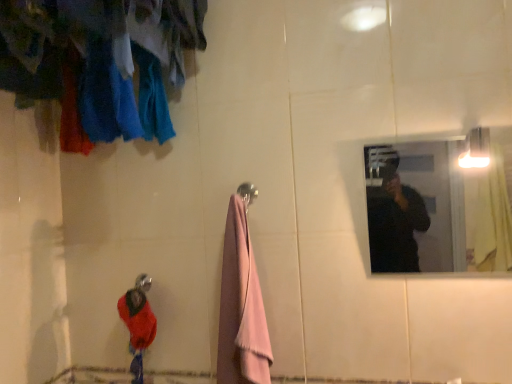
Question: Is velvet red sweater at lower left placed right next to metallic reflective mirror at upper right?

Choices:
 (A) yes
 (B) no

Answer: (B)

Question: Does velvet red sweater at lower left have a smaller size compared to metallic reflective mirror at upper right?

Choices:
 (A) no
 (B) yes

Answer: (B)

Question: Does velvet red sweater at lower left have a lesser width compared to metallic reflective mirror at upper right?

Choices:
 (A) no
 (B) yes

Answer: (A)

Question: Is velvet red sweater at lower left not inside metallic reflective mirror at upper right?

Choices:
 (A) yes
 (B) no

Answer: (A)

Question: Is velvet red sweater at lower left turned away from metallic reflective mirror at upper right?

Choices:
 (A) no
 (B) yes

Answer: (A)

Question: Does point (134, 289) appear closer or farther from the camera than point (224, 304)?

Choices:
 (A) closer
 (B) farther

Answer: (B)

Question: Considering the positions of velvet red sweater at lower left and pink fluffy towel at center in the image, is velvet red sweater at lower left wider or thinner than pink fluffy towel at center?

Choices:
 (A) wide
 (B) thin

Answer: (B)

Question: In terms of size, does velvet red sweater at lower left appear bigger or smaller than pink fluffy towel at center?

Choices:
 (A) small
 (B) big

Answer: (A)

Question: Relative to pink fluffy towel at center, is velvet red sweater at lower left in front or behind?

Choices:
 (A) front
 (B) behind

Answer: (B)

Question: Considering the positions of metallic reflective mirror at upper right and pink fluffy towel at center in the image, is metallic reflective mirror at upper right wider or thinner than pink fluffy towel at center?

Choices:
 (A) wide
 (B) thin

Answer: (B)

Question: Considering the positions of metallic reflective mirror at upper right and pink fluffy towel at center in the image, is metallic reflective mirror at upper right taller or shorter than pink fluffy towel at center?

Choices:
 (A) tall
 (B) short

Answer: (B)

Question: Considering their positions, is metallic reflective mirror at upper right located in front of or behind pink fluffy towel at center?

Choices:
 (A) behind
 (B) front

Answer: (B)

Question: Is metallic reflective mirror at upper right spatially inside pink fluffy towel at center, or outside of it?

Choices:
 (A) outside
 (B) inside

Answer: (A)

Question: Based on their positions, is brushed metal shower head at lower left located to the left or right of velvet red sweater at lower left?

Choices:
 (A) left
 (B) right

Answer: (A)

Question: From a real-world perspective, is brushed metal shower head at lower left positioned above or below velvet red sweater at lower left?

Choices:
 (A) below
 (B) above

Answer: (B)